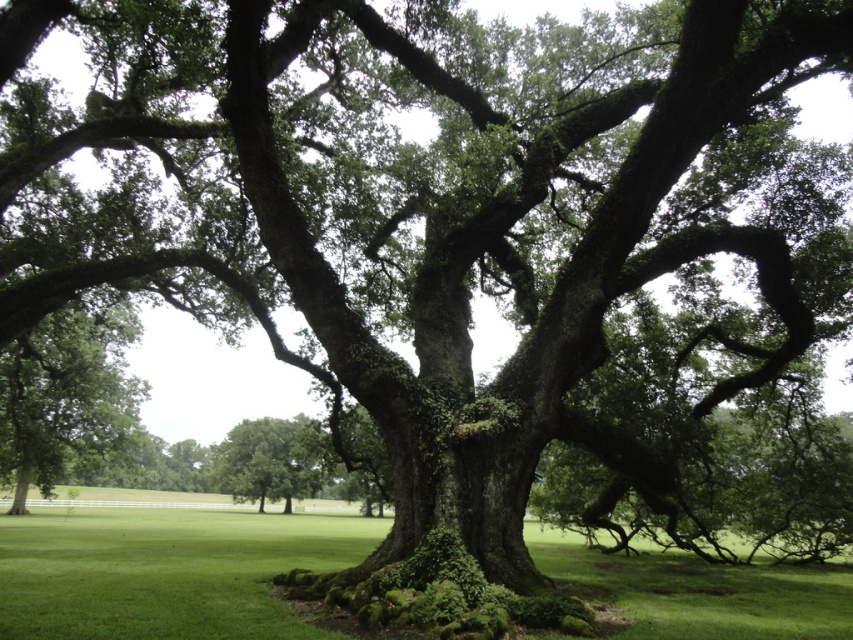
Looking at this image, who is more forward, [704,572] or [325,465]?

Point [704,572] is in front.

Image resolution: width=853 pixels, height=640 pixels. What are the coordinates of `green mossy grass at lower center` in the screenshot? It's located at (165, 570).

Locate an element on the screen. green mossy grass at lower center is located at coordinates (165, 570).